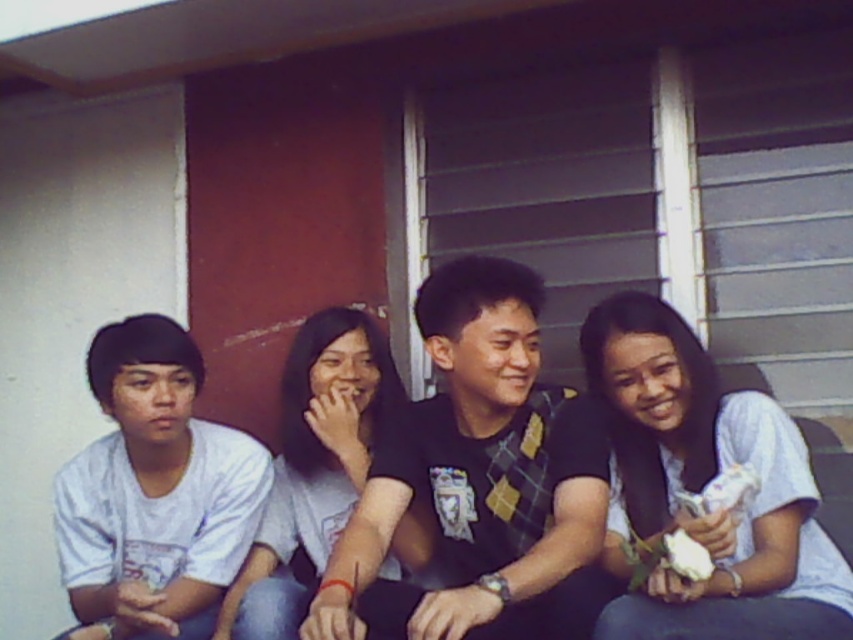
You are standing in front of the group and want to hand a gift to the person wearing the white cotton shirt at right. Which direction should you move to reach them without passing through the black matte shirt at center?

The black matte shirt at center is closer to the viewer than the white cotton shirt at right, so you should move around to the side of the group to reach the white cotton shirt at right without passing through the black matte shirt at center.